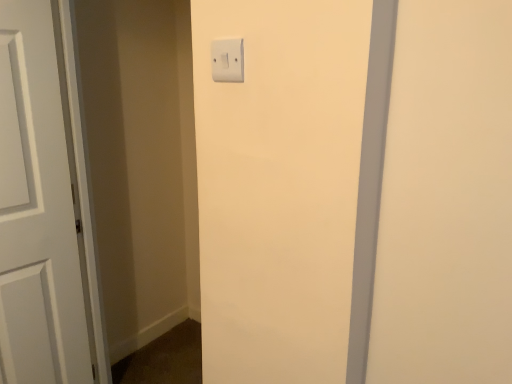
Question: Is white plastic light switch at upper center positioned with its back to white matte door at left?

Choices:
 (A) no
 (B) yes

Answer: (A)

Question: Can you confirm if white plastic light switch at upper center is shorter than white matte door at left?

Choices:
 (A) yes
 (B) no

Answer: (A)

Question: Is white plastic light switch at upper center completely or partially outside of white matte door at left?

Choices:
 (A) no
 (B) yes

Answer: (B)

Question: Considering the relative sizes of white plastic light switch at upper center and white matte door at left in the image provided, is white plastic light switch at upper center wider than white matte door at left?

Choices:
 (A) no
 (B) yes

Answer: (A)

Question: From a real-world perspective, is white plastic light switch at upper center below white matte door at left?

Choices:
 (A) yes
 (B) no

Answer: (B)

Question: Is white plastic light switch at upper center aimed at white matte door at left?

Choices:
 (A) no
 (B) yes

Answer: (A)

Question: From a real-world perspective, is white matte door at left on white plastic light switch at upper center?

Choices:
 (A) yes
 (B) no

Answer: (B)

Question: Would you say white matte door at left contains white plastic light switch at upper center?

Choices:
 (A) yes
 (B) no

Answer: (B)

Question: Can you confirm if white matte door at left is wider than white plastic light switch at upper center?

Choices:
 (A) yes
 (B) no

Answer: (A)

Question: Is white matte door at left completely or partially outside of white plastic light switch at upper center?

Choices:
 (A) no
 (B) yes

Answer: (B)

Question: Considering the relative sizes of white matte door at left and white plastic light switch at upper center in the image provided, is white matte door at left thinner than white plastic light switch at upper center?

Choices:
 (A) yes
 (B) no

Answer: (B)

Question: Would you consider white matte door at left to be distant from white plastic light switch at upper center?

Choices:
 (A) no
 (B) yes

Answer: (A)

Question: Considering the positions of white plastic light switch at upper center and white matte door at left in the image, is white plastic light switch at upper center wider or thinner than white matte door at left?

Choices:
 (A) wide
 (B) thin

Answer: (B)